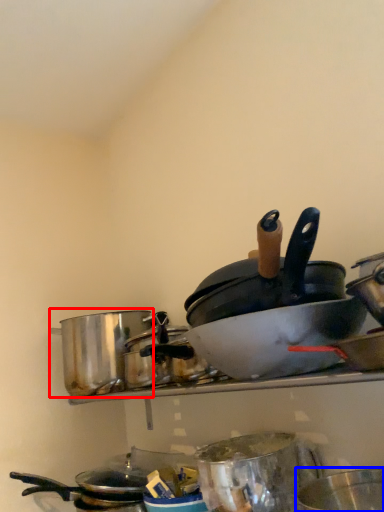
Question: Among these objects, which one is farthest to the camera, crock pot (highlighted by a red box) or basin (highlighted by a blue box)?

Choices:
 (A) crock pot
 (B) basin

Answer: (A)